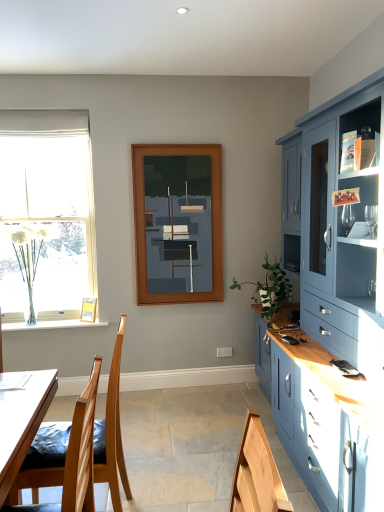
Question: In the image, is wooden chair at lower left positioned in front of or behind wooden picture frame at lower left?

Choices:
 (A) front
 (B) behind

Answer: (A)

Question: Does point (49, 446) appear closer or farther from the camera than point (89, 314)?

Choices:
 (A) closer
 (B) farther

Answer: (A)

Question: Based on their relative distances, which object is farther from the green leafy plant at right?

Choices:
 (A) white fabric curtain at upper left
 (B) wooden chair at lower left
 (C) clear glass vase at left
 (D) wooden picture frame at lower left
 (E) matte wooden frame at center

Answer: (A)

Question: Which object is positioned farthest from the wooden chair at lower left?

Choices:
 (A) white fabric curtain at upper left
 (B) matte wooden frame at center
 (C) wooden picture frame at lower left
 (D) clear glass vase at left
 (E) clear glass vase at left

Answer: (A)